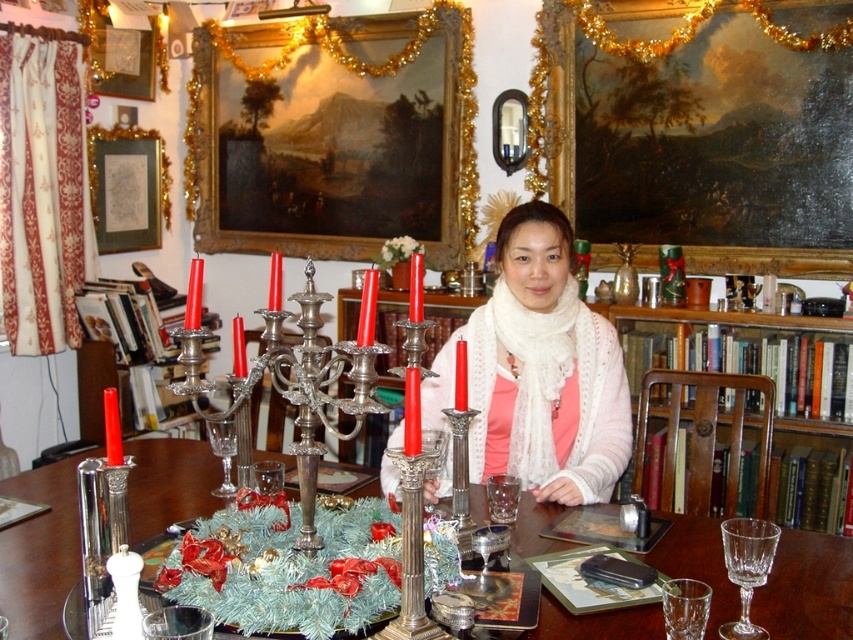
Is gold-framed mirror at upper left above clear crystal wine glass at center?

Indeed, gold-framed mirror at upper left is positioned over clear crystal wine glass at center.

Is point (103, 4) more distant than point (728, 554)?

Yes, point (103, 4) is behind point (728, 554).

Identify the location of gold-framed mirror at upper left. (119, 52).

This screenshot has height=640, width=853. Identify the location of gold-framed mirror at upper left. (119, 52).

Between gold ornate frame at upper left and gold-framed mirror at upper left, which one has more height?

gold ornate frame at upper left

Can you confirm if gold ornate frame at upper left is smaller than gold-framed mirror at upper left?

Actually, gold ornate frame at upper left might be larger than gold-framed mirror at upper left.

Who is more distant from viewer, (142, 225) or (109, 38)?

The point (142, 225) is more distant.

At what (x,y) coordinates should I click in order to perform the action: click on gold ornate frame at upper left. Please return your answer as a coordinate pair (x, y). Looking at the image, I should click on (126, 188).

Can you confirm if metallic silver table at center is positioned to the right of gold-framed mirror at upper left?

Yes, metallic silver table at center is to the right of gold-framed mirror at upper left.

Does point (172, 449) lie behind point (93, 81)?

That is False.

Where is `metallic silver table at center`? metallic silver table at center is located at coordinates (39, 550).